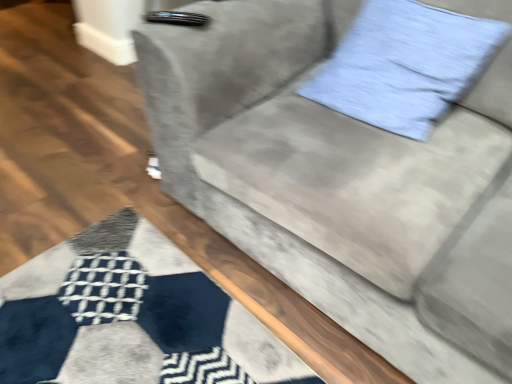
Measure the distance between point (x=256, y=21) and camera.

They are 4.10 feet apart.

What do you see at coordinates (341, 182) in the screenshot? This screenshot has width=512, height=384. I see `velvet gray couch at center` at bounding box center [341, 182].

Find the location of a particular element. This screenshot has width=512, height=384. velvet gray couch at center is located at coordinates (341, 182).

In order to click on light blue fabric pillow at upper right in this screenshot , I will do `click(419, 63)`.

What is the approximate height of light blue fabric pillow at upper right?

light blue fabric pillow at upper right is 13.72 inches tall.

The height and width of the screenshot is (384, 512). Describe the element at coordinates (419, 63) in the screenshot. I see `light blue fabric pillow at upper right` at that location.

Image resolution: width=512 pixels, height=384 pixels. I want to click on velvet gray couch at center, so click(341, 182).

Considering the positions of objects light blue fabric pillow at upper right and velvet gray couch at center in the image provided, who is more to the left, light blue fabric pillow at upper right or velvet gray couch at center?

velvet gray couch at center is more to the left.

Which object is further away from the camera, light blue fabric pillow at upper right or velvet gray couch at center?

light blue fabric pillow at upper right is more distant.

Between point (398, 105) and point (307, 72), which one is positioned in front?

The point (398, 105) is more forward.

From the image's perspective, between light blue fabric pillow at upper right and velvet gray couch at center, who is located below?

velvet gray couch at center, from the image's perspective.

From a real-world perspective, who is located higher, light blue fabric pillow at upper right or velvet gray couch at center?

light blue fabric pillow at upper right is physically above.

Which object is thinner, light blue fabric pillow at upper right or velvet gray couch at center?

light blue fabric pillow at upper right is thinner.

Considering the sizes of light blue fabric pillow at upper right and velvet gray couch at center in the image, is light blue fabric pillow at upper right taller or shorter than velvet gray couch at center?

Considering their sizes, light blue fabric pillow at upper right has less height than velvet gray couch at center.

Can you confirm if light blue fabric pillow at upper right is smaller than velvet gray couch at center?

Indeed, light blue fabric pillow at upper right has a smaller size compared to velvet gray couch at center.

Could velvet gray couch at center be considered to be inside light blue fabric pillow at upper right?

No, velvet gray couch at center is not surrounded by light blue fabric pillow at upper right.

Based on the photo, are light blue fabric pillow at upper right and velvet gray couch at center far apart?

No, light blue fabric pillow at upper right is not far away from velvet gray couch at center.

Is light blue fabric pillow at upper right turned away from velvet gray couch at center?

Yes.

At what (x,y) coordinates should I click in order to perform the action: click on studio couch below the light blue fabric pillow at upper right (from the image's perspective). Please return your answer as a coordinate pair (x, y). The height and width of the screenshot is (384, 512). Looking at the image, I should click on (341, 182).

Considering the positions of objects velvet gray couch at center and light blue fabric pillow at upper right in the image provided, who is more to the left, velvet gray couch at center or light blue fabric pillow at upper right?

Positioned to the left is velvet gray couch at center.

Does velvet gray couch at center lie in front of light blue fabric pillow at upper right?

Yes, velvet gray couch at center is closer to the camera.

Looking at this image, which is closer to the camera, [166,116] or [314,92]?

The point [166,116] is in front.

From the image's perspective, is velvet gray couch at center below light blue fabric pillow at upper right?

Yes.

From a real-world perspective, is velvet gray couch at center over light blue fabric pillow at upper right?

No, from a real-world perspective, velvet gray couch at center is not over light blue fabric pillow at upper right

Considering the sizes of velvet gray couch at center and light blue fabric pillow at upper right in the image, is velvet gray couch at center wider or thinner than light blue fabric pillow at upper right?

Considering their sizes, velvet gray couch at center looks broader than light blue fabric pillow at upper right.

Based on the photo, between velvet gray couch at center and light blue fabric pillow at upper right, which one has more height?

velvet gray couch at center is taller.

Between velvet gray couch at center and light blue fabric pillow at upper right, which one has larger size?

velvet gray couch at center.

Is velvet gray couch at center situated inside light blue fabric pillow at upper right or outside?

velvet gray couch at center is not enclosed by light blue fabric pillow at upper right.

Is velvet gray couch at center next to light blue fabric pillow at upper right?

No, velvet gray couch at center is not making contact with light blue fabric pillow at upper right.

Is velvet gray couch at center facing towards light blue fabric pillow at upper right?

Yes, velvet gray couch at center faces towards light blue fabric pillow at upper right.

I want to click on studio couch directly beneath the light blue fabric pillow at upper right (from a real-world perspective), so click(341, 182).

Locate an element on the screen. This screenshot has width=512, height=384. pillow behind the velvet gray couch at center is located at coordinates (419, 63).

In the image, there is a velvet gray couch at center. Find the location of `pillow above it (from the image's perspective)`. pillow above it (from the image's perspective) is located at coordinates (x=419, y=63).